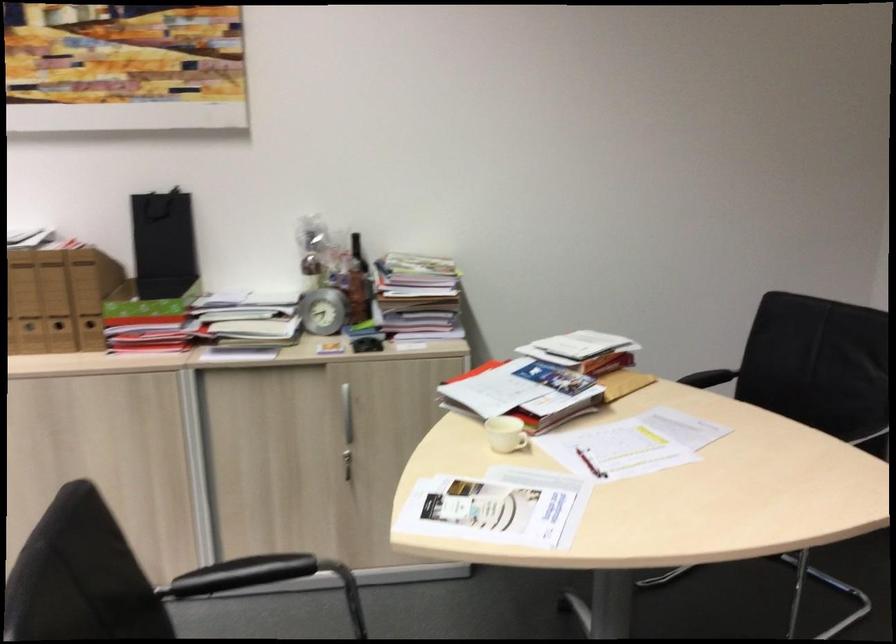
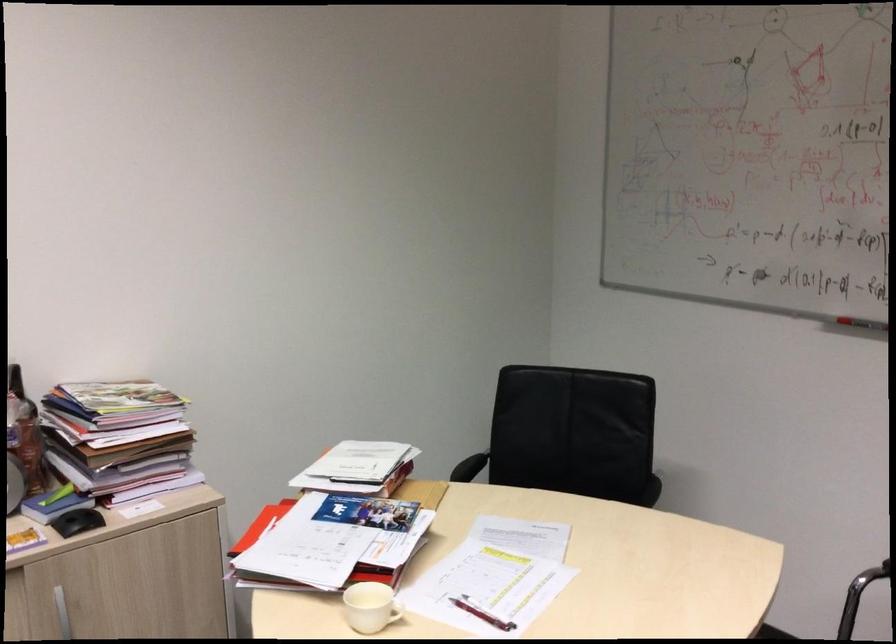
The point at (682, 421) is marked in the first image. Where is the corresponding point in the second image?

(515, 529)